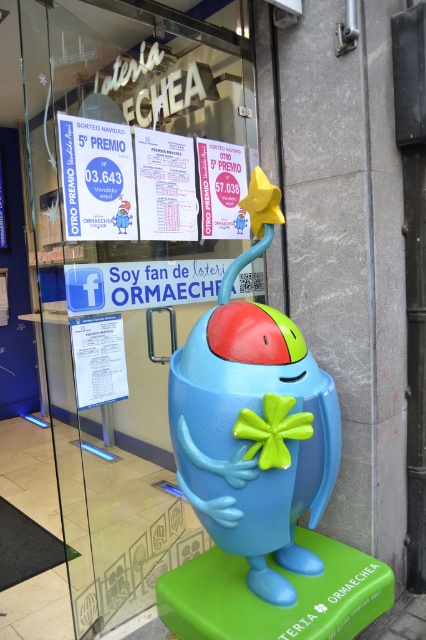
Question: Does matte plastic toy at center have a lesser width compared to matte pink paper at upper center?

Choices:
 (A) no
 (B) yes

Answer: (A)

Question: Does transparent glass at center have a smaller size compared to matte pink paper at upper center?

Choices:
 (A) no
 (B) yes

Answer: (A)

Question: Considering the real-world distances, which object is closest to the transparent glass at center?

Choices:
 (A) white paper sign at upper left
 (B) matte plastic toy at center
 (C) matte pink paper at upper center

Answer: (A)

Question: Estimate the real-world distances between objects in this image. Which object is farther from the transparent glass at center?

Choices:
 (A) matte plastic toy at center
 (B) white paper sign at upper left

Answer: (A)

Question: Which object is closer to the camera taking this photo?

Choices:
 (A) white paper sign at upper left
 (B) matte plastic toy at center
 (C) matte pink paper at upper center

Answer: (B)

Question: Is transparent glass at center to the right of matte plastic toy at center from the viewer's perspective?

Choices:
 (A) yes
 (B) no

Answer: (B)